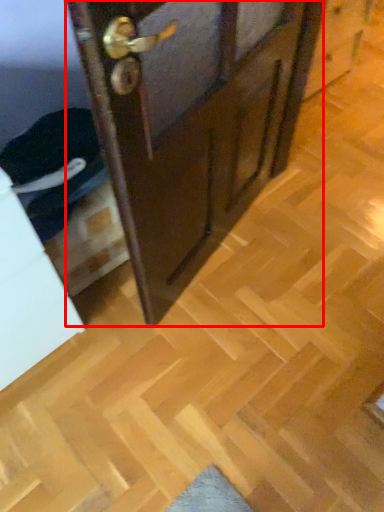
Question: From the image's perspective, what is the correct spatial positioning of door (annotated by the red box) in reference to drawer?

Choices:
 (A) below
 (B) above

Answer: (B)